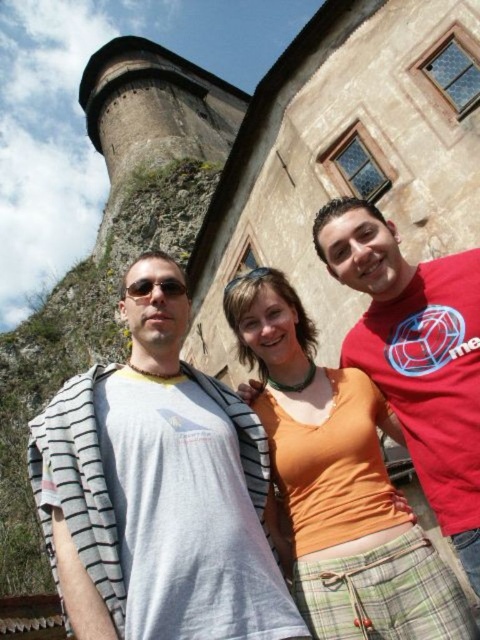
Is gray striped shirt at left taller than orange fabric top at center?

Yes.

Measure the distance from gray striped shirt at left to orange fabric top at center.

A distance of 4.49 meters exists between gray striped shirt at left and orange fabric top at center.

I want to click on gray striped shirt at left, so click(157, 490).